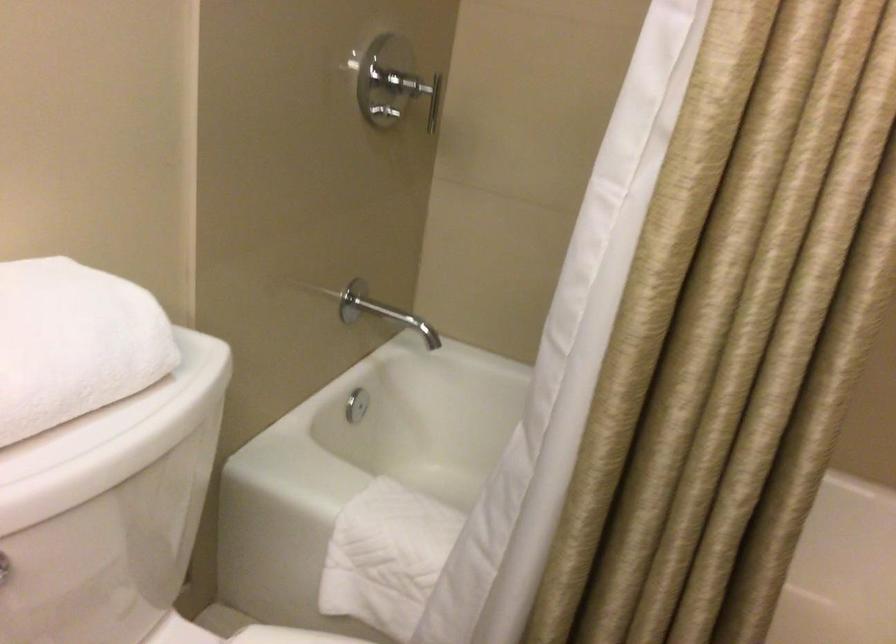
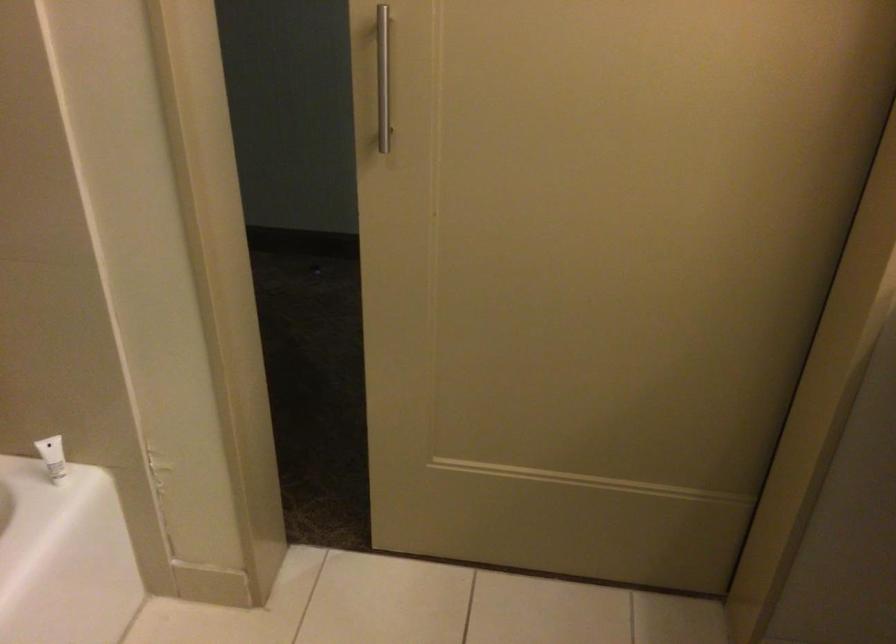
How did the camera likely rotate?

The rotation direction of the camera is right-down.